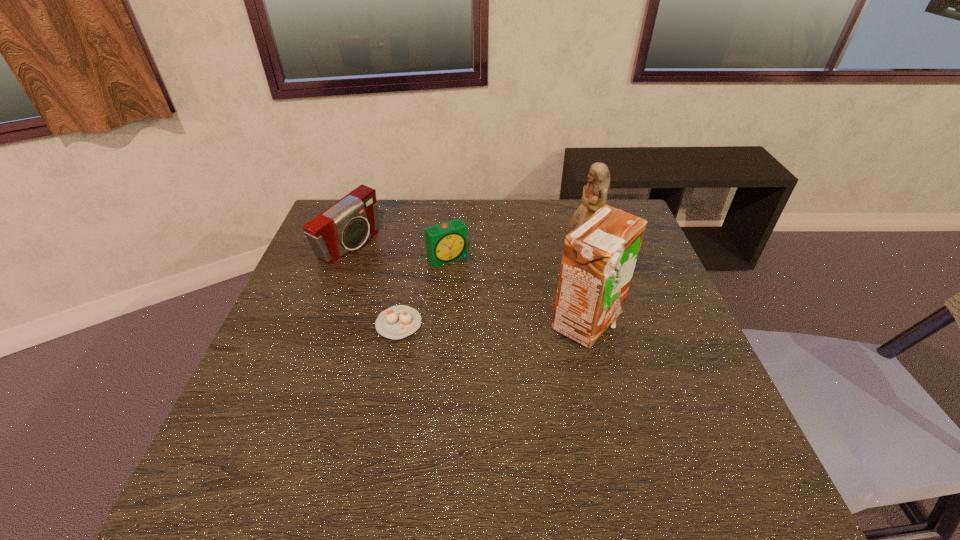
You are a GUI agent. You are given a task and a screenshot of the screen. Output one action in this format:
    pyautogui.click(x=<x>, y=<y>)
    Task: Click on the cupcake
    The height and width of the screenshot is (540, 960).
    Given the screenshot: What is the action you would take?
    pyautogui.click(x=396, y=322)

Where is `carton`? This screenshot has width=960, height=540. carton is located at coordinates (599, 257).

I want to click on alarm clock, so click(x=446, y=242).

Locate an element on the screen. figurine is located at coordinates (594, 197).

Locate an element on the screen. This screenshot has width=960, height=540. the third shortest object is located at coordinates (345, 226).

Identify the location of camera. [x=345, y=226].

Locate an element on the screen. The width and height of the screenshot is (960, 540). free region located 0.090m on the front of the shortest object is located at coordinates (390, 374).

This screenshot has width=960, height=540. In order to click on vacant space positioned on the straw side of the carton in this screenshot , I will do `click(658, 323)`.

Where is `vacant position located 0.400m on the front-facing side of the second shortest object`? The image size is (960, 540). vacant position located 0.400m on the front-facing side of the second shortest object is located at coordinates (536, 368).

Where is `vacant space located on the front-facing side of the second shortest object`? Image resolution: width=960 pixels, height=540 pixels. vacant space located on the front-facing side of the second shortest object is located at coordinates (497, 319).